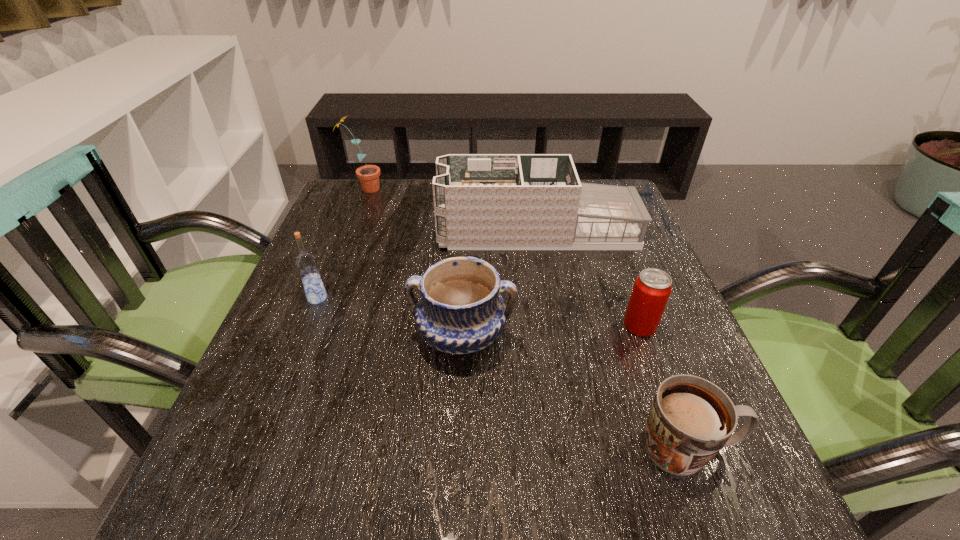
Where is `free space that satisfies the following two spatial constraints: 1. at the entrance of the dollhouse; 2. on the right side of the can`? Image resolution: width=960 pixels, height=540 pixels. free space that satisfies the following two spatial constraints: 1. at the entrance of the dollhouse; 2. on the right side of the can is located at coordinates (553, 326).